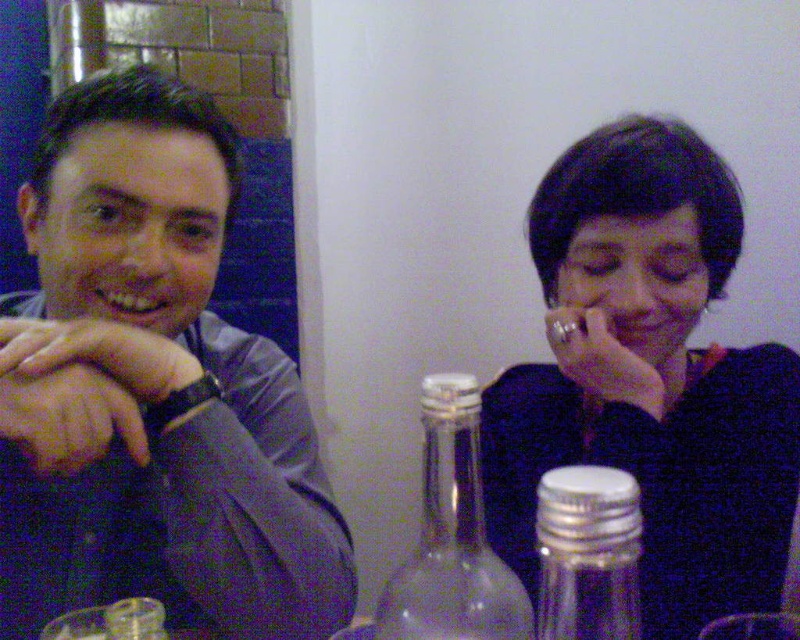
Question: Among these objects, which one is farthest from the camera?

Choices:
 (A) matte gray shirt at left
 (B) matte black wristwatch at left

Answer: (B)

Question: Is matte gray shirt at left to the right of metallic ring at upper right from the viewer's perspective?

Choices:
 (A) no
 (B) yes

Answer: (A)

Question: Which of the following is the closest to the observer?

Choices:
 (A) clear glass salt shaker at lower right
 (B) matte gray shirt at left

Answer: (A)

Question: Is matte gray shirt at left below metallic ring at upper right?

Choices:
 (A) no
 (B) yes

Answer: (A)

Question: Which object is farther from the camera taking this photo?

Choices:
 (A) matte black wristwatch at left
 (B) matte gray shirt at left
 (C) metallic ring at upper right

Answer: (C)

Question: Does matte gray shirt at left appear on the right side of metallic ring at upper right?

Choices:
 (A) yes
 (B) no

Answer: (B)